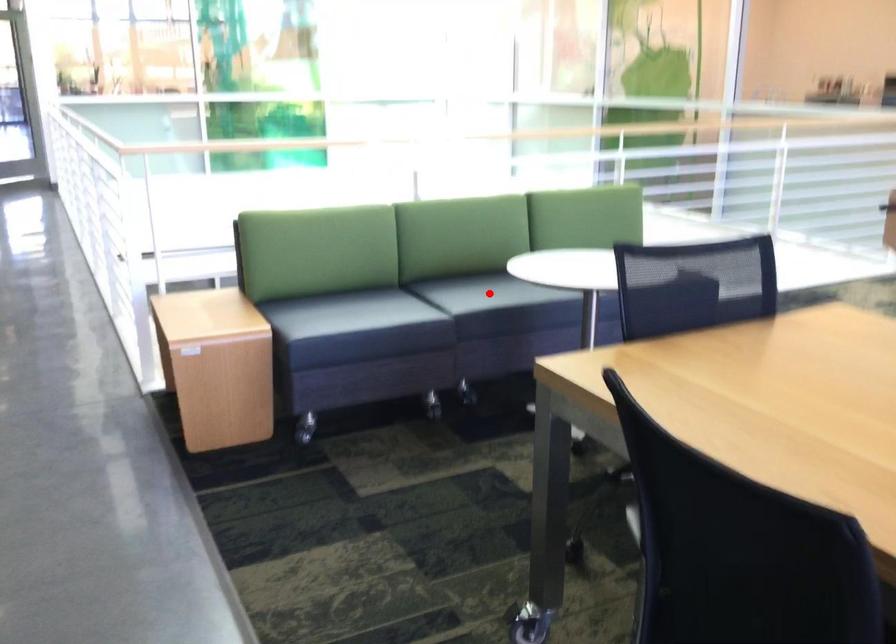
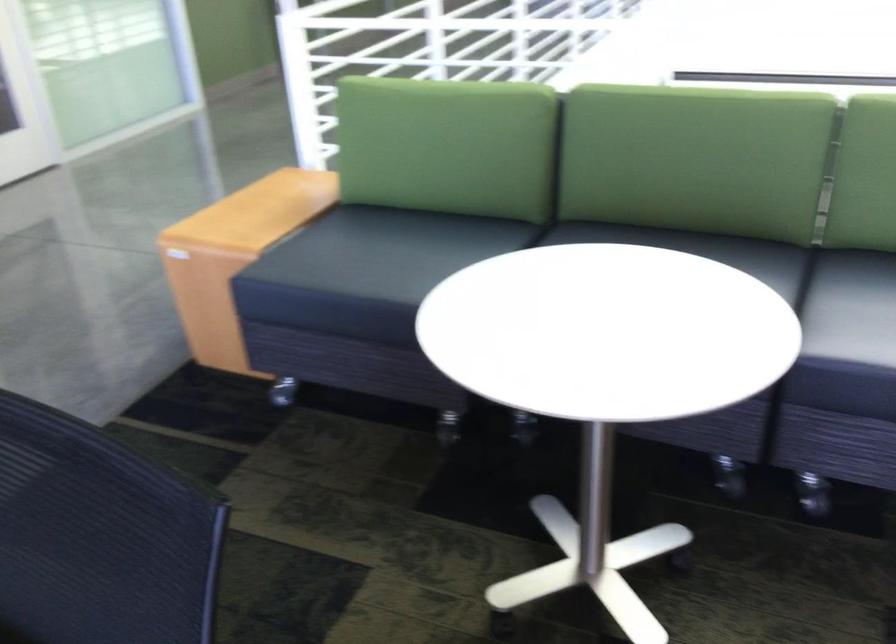
Question: I am providing you with two images of the same scene from different viewpoints. A red point is marked on the first image. Is the red point's position out of view in image 2?

Choices:
 (A) Yes
 (B) No

Answer: (A)